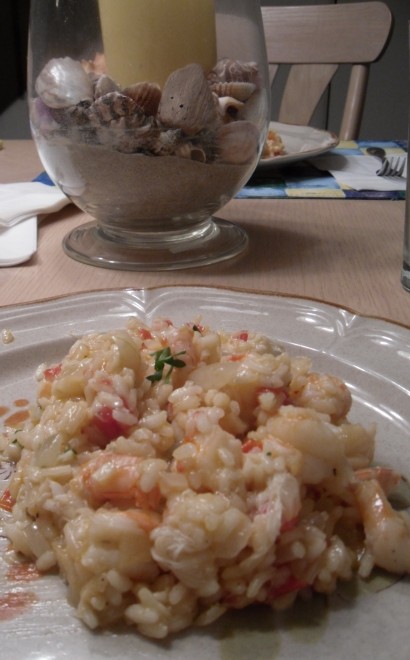
Locate an element on the screen. The height and width of the screenshot is (660, 410). fork is located at coordinates (394, 168).